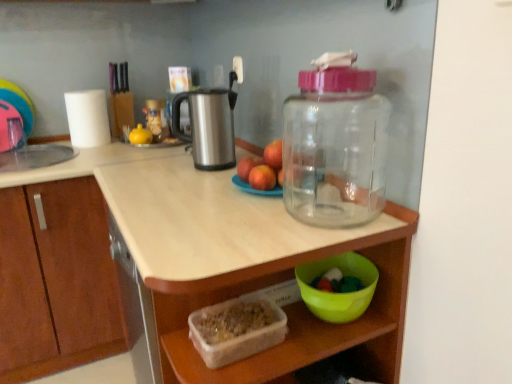
Question: Is translucent plastic container at lower center taller or shorter than green plastic bowl at lower right, positioned as the 2th bowl in left-to-right order?

Choices:
 (A) tall
 (B) short

Answer: (A)

Question: From the image's perspective, is translucent plastic container at lower center positioned above or below green plastic bowl at lower right, which is the 1th bowl in right-to-left order?

Choices:
 (A) below
 (B) above

Answer: (A)

Question: Which object is the farthest from the white matte paper towel at upper left?

Choices:
 (A) translucent plastic container at lower center, which is counted as the 1th bowl, starting from the left
 (B) red matte apple at center
 (C) yellow rubber duck at center
 (D) matte white countertop at center
 (E) transparent plastic bottle at upper right

Answer: (A)

Question: Estimate the real-world distances between objects in this image. Which object is farther from the red matte apple at center?

Choices:
 (A) matte white countertop at center
 (B) white matte paper towel at upper left
 (C) green plastic bowl at lower right, positioned as the 2th bowl in left-to-right order
 (D) translucent plastic container at lower center, which appears as the second bowl when viewed from the right
 (E) translucent plastic container at lower center

Answer: (B)